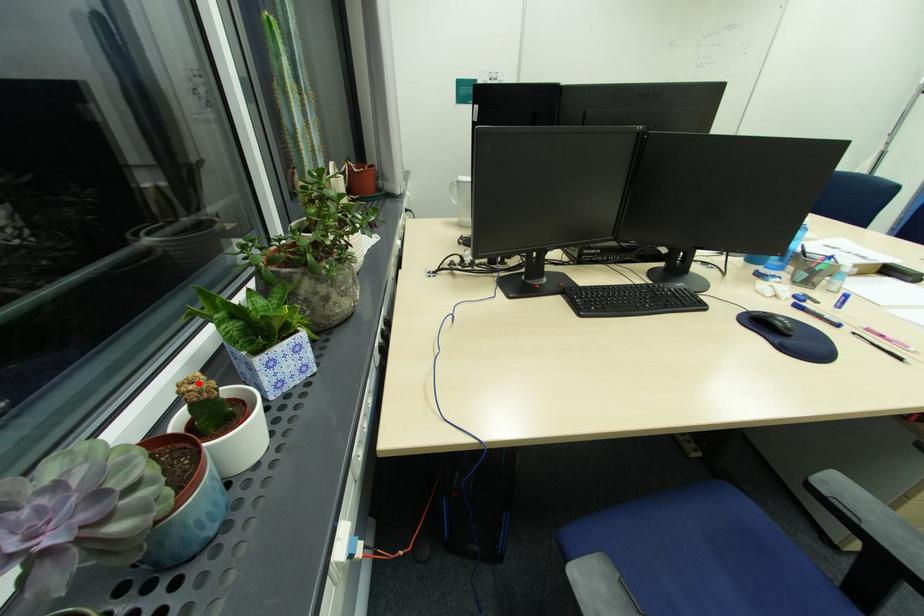
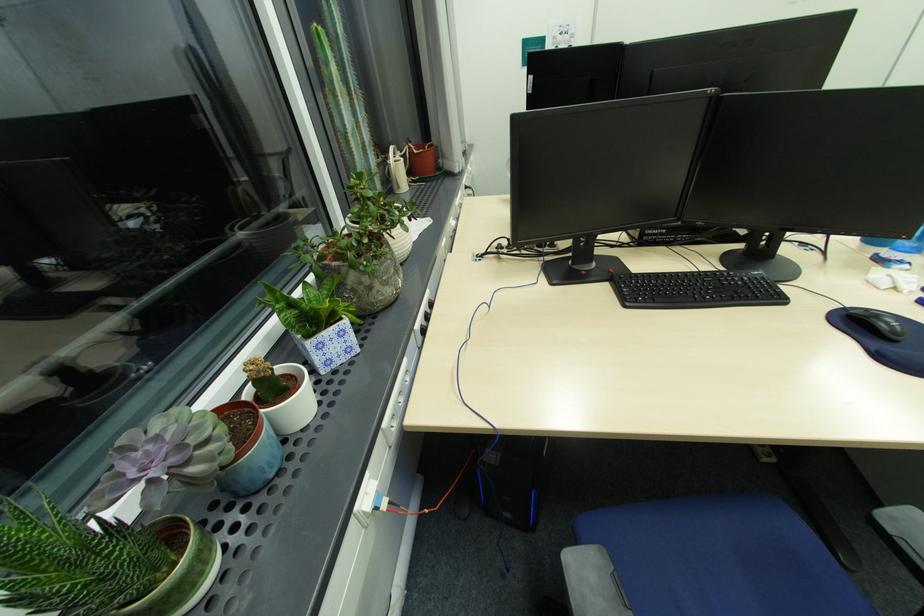
Locate, in the second image, the point that corresponds to the highlighted location in the first image.

(259, 363)